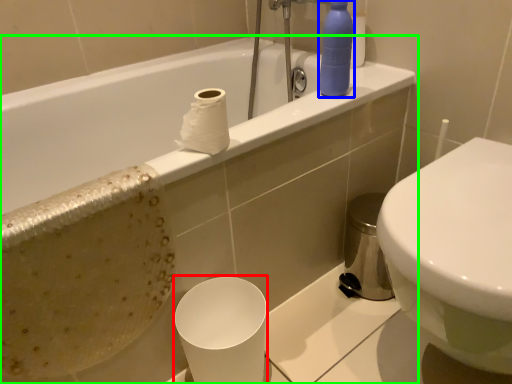
Question: Estimate the real-world distances between objects in this image. Which object is farther from paper cup (highlighted by a red box), cleaning product (highlighted by a blue box) or bathtub (highlighted by a green box)?

Choices:
 (A) cleaning product
 (B) bathtub

Answer: (A)